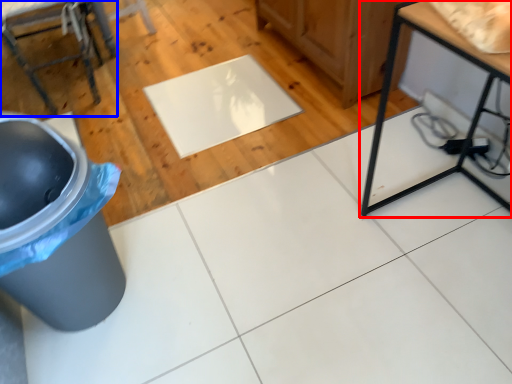
Question: Which object is closer to the camera taking this photo, table (highlighted by a red box) or furniture (highlighted by a blue box)?

Choices:
 (A) table
 (B) furniture

Answer: (A)